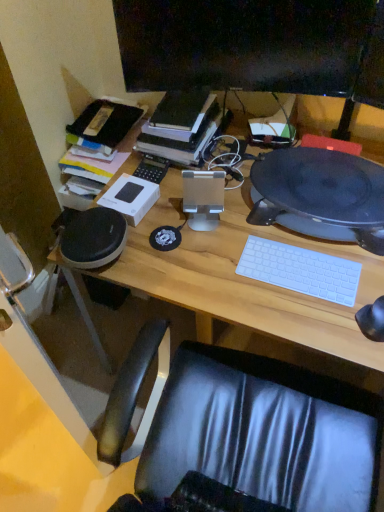
Question: From the image's perspective, is wooden desk at center above or below hardcover book at center?

Choices:
 (A) below
 (B) above

Answer: (A)

Question: In terms of size, does wooden desk at center appear bigger or smaller than hardcover book at center?

Choices:
 (A) big
 (B) small

Answer: (A)

Question: Based on their relative distances, which object is farther from the wooden desk at center?

Choices:
 (A) black matte speaker at right
 (B) white matte keyboard at center
 (C) hardcover book at center
 (D) black glossy monitor at upper center

Answer: (D)

Question: Estimate the real-world distances between objects in this image. Which object is closer to the wooden desk at center?

Choices:
 (A) black glossy monitor at upper center
 (B) hardcover book at center
 (C) black matte speaker at right
 (D) white matte keyboard at center

Answer: (D)